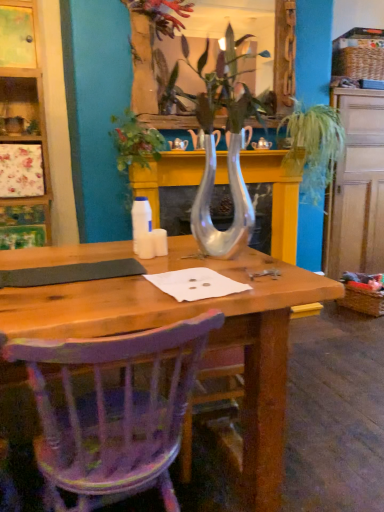
Question: Considering the relative sizes of metallic silver flower at upper center and purple painted wood chair at lower left in the image provided, is metallic silver flower at upper center shorter than purple painted wood chair at lower left?

Choices:
 (A) no
 (B) yes

Answer: (B)

Question: Does metallic silver flower at upper center have a lesser width compared to purple painted wood chair at lower left?

Choices:
 (A) no
 (B) yes

Answer: (B)

Question: Is metallic silver flower at upper center wider than purple painted wood chair at lower left?

Choices:
 (A) no
 (B) yes

Answer: (A)

Question: Can you confirm if metallic silver flower at upper center is bigger than purple painted wood chair at lower left?

Choices:
 (A) yes
 (B) no

Answer: (B)

Question: From the image's perspective, does metallic silver flower at upper center appear lower than purple painted wood chair at lower left?

Choices:
 (A) no
 (B) yes

Answer: (A)

Question: Visually, is wooden dresser at right positioned to the left or to the right of woven straw picnic basket at lower right?

Choices:
 (A) left
 (B) right

Answer: (B)

Question: From a real-world perspective, is wooden dresser at right physically located above or below woven straw picnic basket at lower right?

Choices:
 (A) below
 (B) above

Answer: (B)

Question: Based on their sizes in the image, would you say wooden dresser at right is bigger or smaller than woven straw picnic basket at lower right?

Choices:
 (A) small
 (B) big

Answer: (B)

Question: In terms of width, does wooden dresser at right look wider or thinner when compared to woven straw picnic basket at lower right?

Choices:
 (A) wide
 (B) thin

Answer: (A)

Question: Is woven straw picnic basket at lower right inside the boundaries of green leafy plant at upper right, or outside?

Choices:
 (A) outside
 (B) inside

Answer: (A)

Question: From a real-world perspective, is woven straw picnic basket at lower right physically located above or below green leafy plant at upper right?

Choices:
 (A) above
 (B) below

Answer: (B)

Question: From the image's perspective, is woven straw picnic basket at lower right above or below green leafy plant at upper right?

Choices:
 (A) above
 (B) below

Answer: (B)

Question: Considering the positions of woven straw picnic basket at lower right and green leafy plant at upper right in the image, is woven straw picnic basket at lower right bigger or smaller than green leafy plant at upper right?

Choices:
 (A) small
 (B) big

Answer: (A)

Question: Based on their sizes in the image, would you say green leafy plant at upper right is bigger or smaller than purple painted wood chair at lower left?

Choices:
 (A) big
 (B) small

Answer: (A)

Question: From a real-world perspective, is green leafy plant at upper right above or below purple painted wood chair at lower left?

Choices:
 (A) above
 (B) below

Answer: (A)